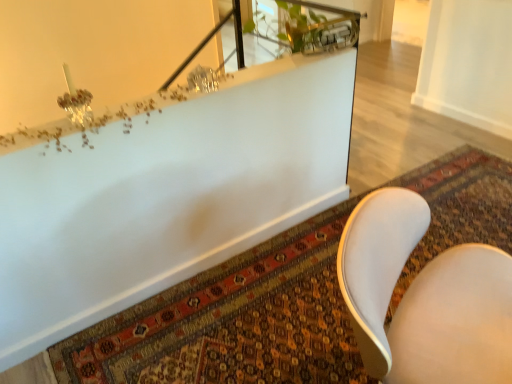
Question: Looking at their shapes, would you say carpeted mat at lower center is wider or thinner than white glossy bathtub at upper center?

Choices:
 (A) thin
 (B) wide

Answer: (A)

Question: Is carpeted mat at lower center to the left or to the right of white glossy bathtub at upper center in the image?

Choices:
 (A) right
 (B) left

Answer: (A)

Question: Which object is the farthest from the white glossy bathtub at upper center?

Choices:
 (A) white leather chair at lower right
 (B) carpeted mat at lower center

Answer: (A)

Question: Estimate the real-world distances between objects in this image. Which object is farther from the white leather chair at lower right?

Choices:
 (A) white glossy bathtub at upper center
 (B) carpeted mat at lower center

Answer: (A)